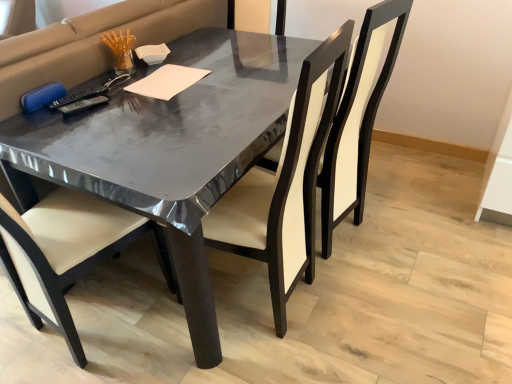
Identify the location of free space above white paper at center (from a real-world perspective). The height and width of the screenshot is (384, 512). (166, 81).